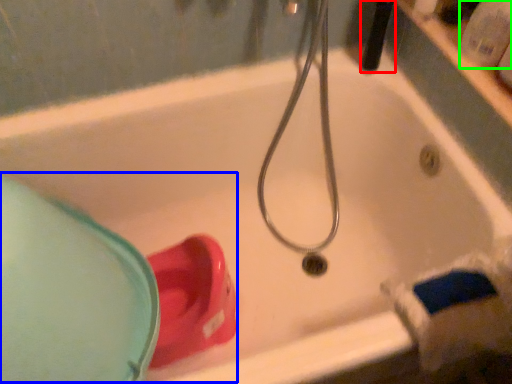
Question: Which is nearer to the shower (highlighted by a red box)? sink (highlighted by a blue box) or toiletry (highlighted by a green box).

Choices:
 (A) sink
 (B) toiletry

Answer: (B)